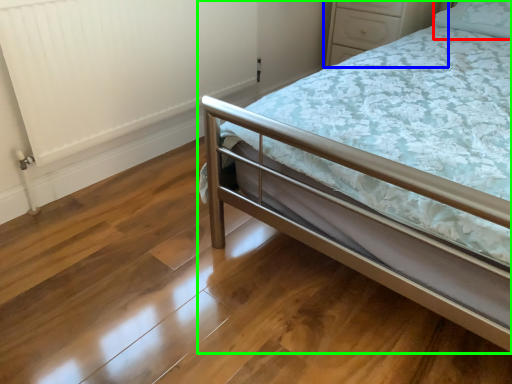
Question: Which object is the closest to the pillow (highlighted by a red box)? Choose among these: dresser (highlighted by a blue box) or bed (highlighted by a green box).

Choices:
 (A) dresser
 (B) bed

Answer: (A)